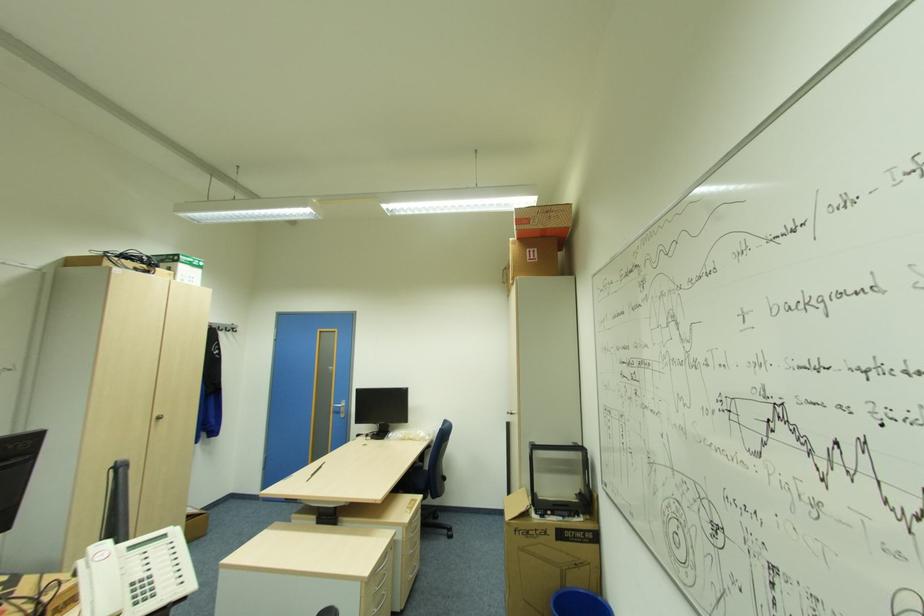
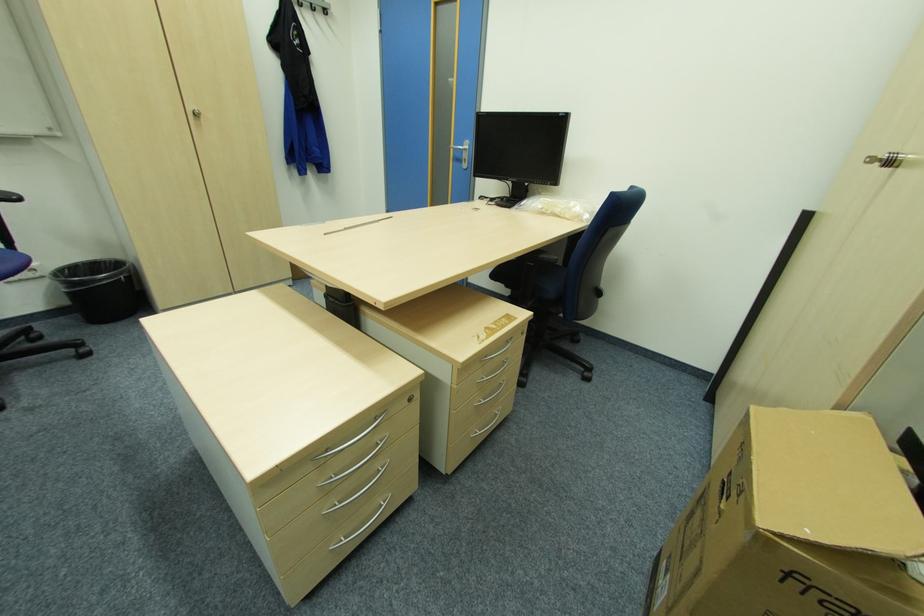
In the second image, find the point that corresponds to the point at 346,406 in the first image.

(468, 148)